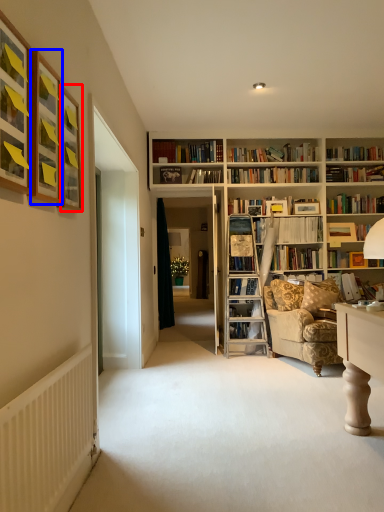
Question: Which object appears closest to the camera in this image, picture frame (highlighted by a red box) or picture frame (highlighted by a blue box)?

Choices:
 (A) picture frame
 (B) picture frame

Answer: (B)